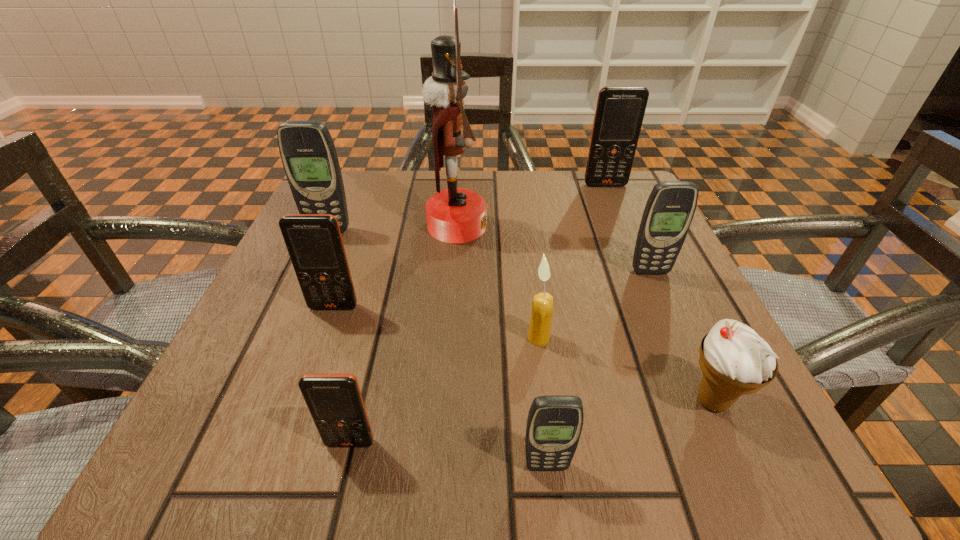
Image resolution: width=960 pixels, height=540 pixels. In order to click on vacant space located on the screen of the leftmost gray cellular telephone in this screenshot , I will do `click(268, 366)`.

Identify the location of free space located 0.110m on the screen of the sixth nearest object. (671, 320).

The image size is (960, 540). I want to click on free space located 0.180m on the screen of the fourth farthest cellular telephone, so click(299, 408).

Locate an element on the screen. vacant space located 0.060m on the back of the candle is located at coordinates (534, 303).

At what (x,y) coordinates should I click in order to perform the action: click on vacant space located on the back of the white icecream. Please return your answer as a coordinate pair (x, y). Looking at the image, I should click on (675, 319).

Where is `nutcracker present at the far edge`? nutcracker present at the far edge is located at coordinates (455, 215).

Where is `icecream that is at the near edge`? Image resolution: width=960 pixels, height=540 pixels. icecream that is at the near edge is located at coordinates (735, 360).

Locate an element on the screen. icecream that is at the right edge is located at coordinates (735, 360).

Where is `object located at the far left corner`? The height and width of the screenshot is (540, 960). object located at the far left corner is located at coordinates (308, 154).

Locate an element on the screen. object at the far right corner is located at coordinates (620, 110).